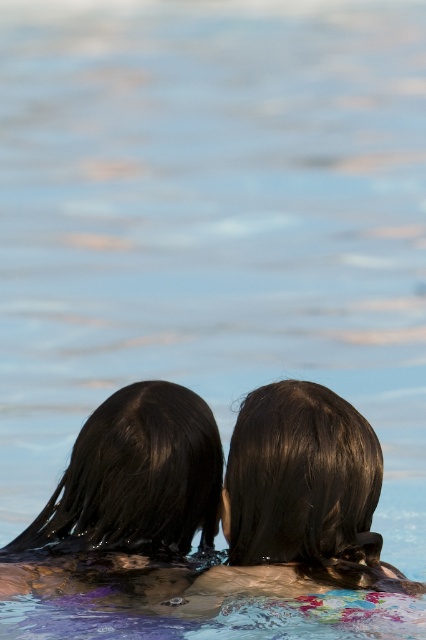
Question: Can you confirm if shiny dark hair at center is positioned to the left of wet dark brown hair at center?

Choices:
 (A) no
 (B) yes

Answer: (A)

Question: Which of the following is the closest to the observer?

Choices:
 (A) [x=66, y=522]
 (B) [x=370, y=538]

Answer: (B)

Question: Does shiny dark hair at center have a greater width compared to wet dark brown hair at center?

Choices:
 (A) yes
 (B) no

Answer: (A)

Question: Which point appears closest to the camera in this image?

Choices:
 (A) (256, 554)
 (B) (83, 525)

Answer: (A)

Question: Which object is closer to the camera taking this photo?

Choices:
 (A) shiny dark hair at center
 (B) wet dark brown hair at center

Answer: (A)

Question: Does shiny dark hair at center have a larger size compared to wet dark brown hair at center?

Choices:
 (A) no
 (B) yes

Answer: (A)